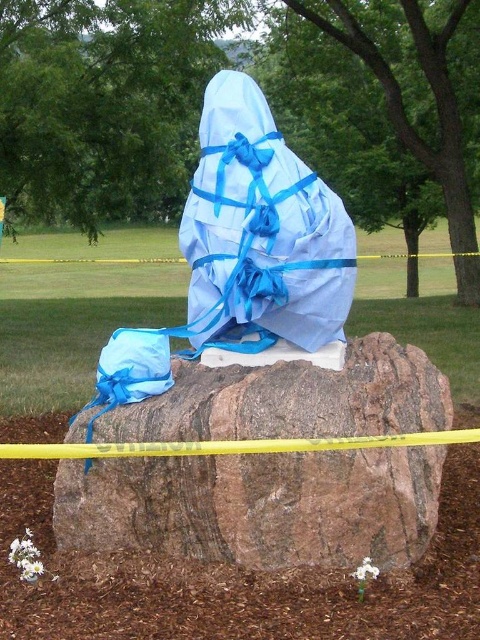
You are a delivery person who needs to place a heavy box on the brown rough rock at center. The box is as wide as the blue fabric bag at center. Will the box fit on the rock?

The brown rough rock at center might be wider than blue fabric bag at center, so the box, which is as wide as the blue fabric bag at center, should fit on the rock since the rock might be wider.

You are standing at the edge of the scene looking towards the center. There is a point marked at coordinates (x=255, y=506). What object is located at that point?

The point at coordinates (x=255, y=506) corresponds to the brown rough rock at center.